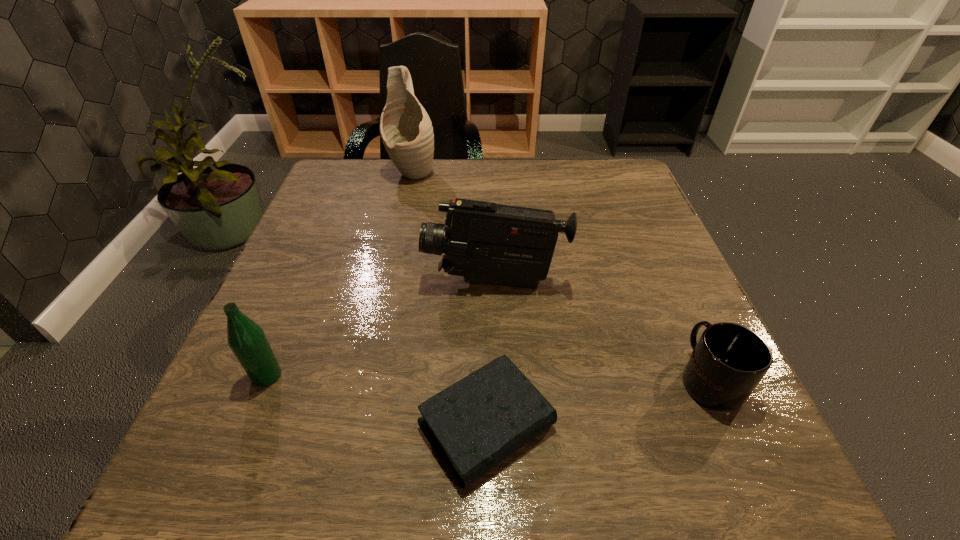
Find the location of a particular element. Image resolution: width=960 pixels, height=540 pixels. object located in the right edge section of the desktop is located at coordinates (729, 360).

Locate an element on the screen. The height and width of the screenshot is (540, 960). object present at the far left corner is located at coordinates (406, 130).

Where is `free region at the far edge of the desktop`? free region at the far edge of the desktop is located at coordinates tap(430, 200).

Identify the location of vacant space at the near edge of the desktop. (376, 444).

This screenshot has height=540, width=960. Find the location of `vacant space at the left edge`. vacant space at the left edge is located at coordinates (x=278, y=343).

The height and width of the screenshot is (540, 960). In the image, there is a desktop. What are the coordinates of `vacant space at the right edge` in the screenshot? It's located at (635, 224).

The image size is (960, 540). In the image, there is a desktop. What are the coordinates of `vacant area at the far left corner` in the screenshot? It's located at (361, 166).

In the image, there is a desktop. Identify the location of vacant space at the far right corner. (634, 189).

This screenshot has height=540, width=960. What are the coordinates of `free space that is in between the leftmost object and the tallest object` in the screenshot? It's located at (340, 274).

Identify the location of free spot between the shortest object and the leftmost object. The height and width of the screenshot is (540, 960). (376, 400).